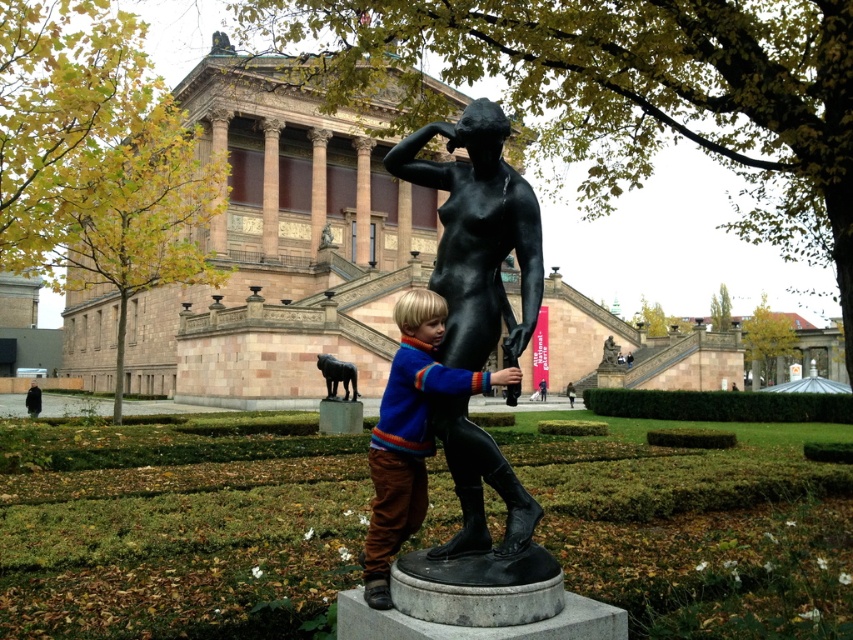
Which is more to the left, black polished statue at center or blue wool sweater at center?

blue wool sweater at center

Identify the location of black polished statue at center. (479, 234).

Is black marble statue at center to the left of black polished statue at center from the viewer's perspective?

Incorrect, black marble statue at center is not on the left side of black polished statue at center.

Who is positioned more to the left, black marble statue at center or black polished statue at center?

black polished statue at center

The image size is (853, 640). In order to click on black marble statue at center in this screenshot , I will do `click(178, 534)`.

Does black marble statue at center have a larger size compared to blue wool sweater at center?

Yes.

Is the position of black marble statue at center less distant than that of blue wool sweater at center?

That is True.

This screenshot has height=640, width=853. Find the location of `black marble statue at center`. black marble statue at center is located at coordinates (178, 534).